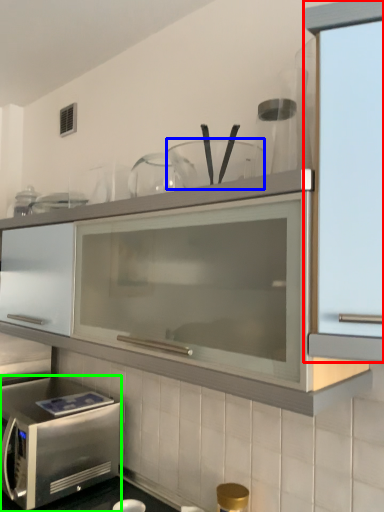
Question: Which object is the farthest from cabinetry (highlighted by a red box)? Choose among these: tableware (highlighted by a blue box) or microwave oven (highlighted by a green box).

Choices:
 (A) tableware
 (B) microwave oven

Answer: (B)